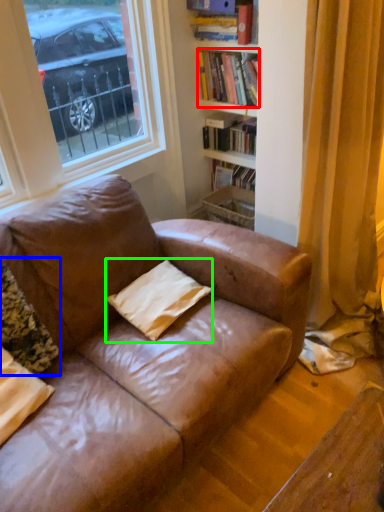
Question: Which object is the closest to the book (highlighted by a red box)? Choose among these: pillow (highlighted by a blue box) or pillow (highlighted by a green box).

Choices:
 (A) pillow
 (B) pillow

Answer: (B)